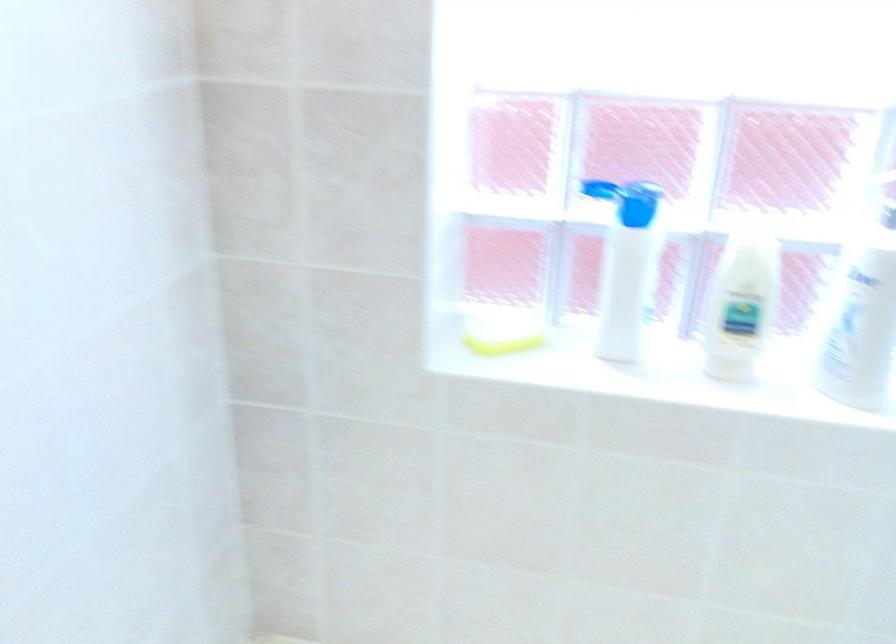
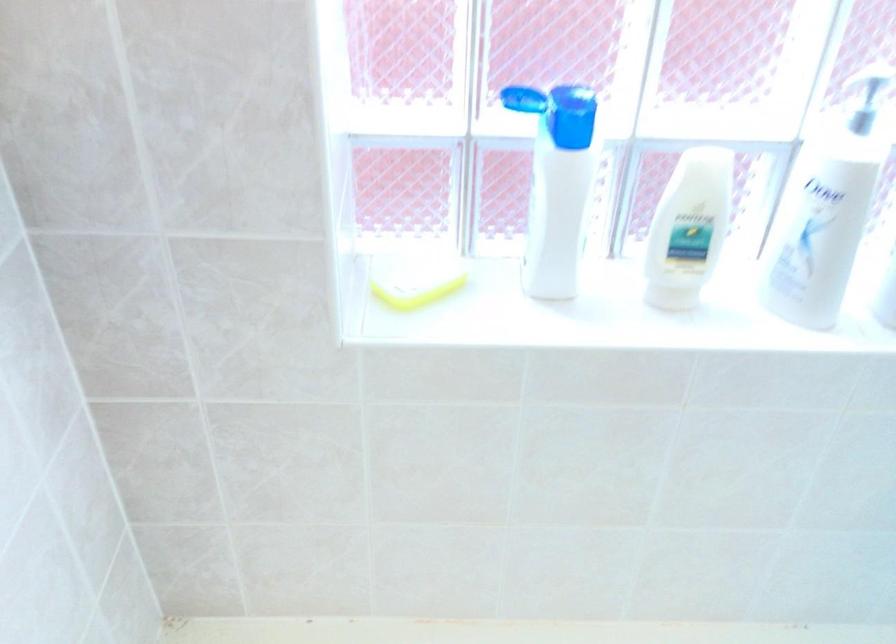
Looking at this image, which direction would the cameraman need to move to produce the second image?

The cameraman walked toward left, forward.